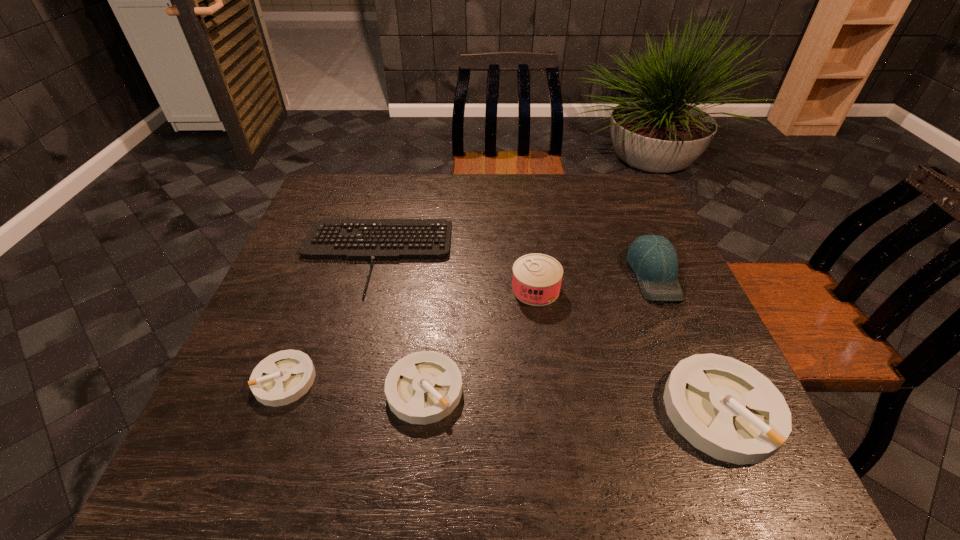
Image resolution: width=960 pixels, height=540 pixels. I want to click on vacant spot for a new ashtray to ensure equal spacing, so click(x=570, y=400).